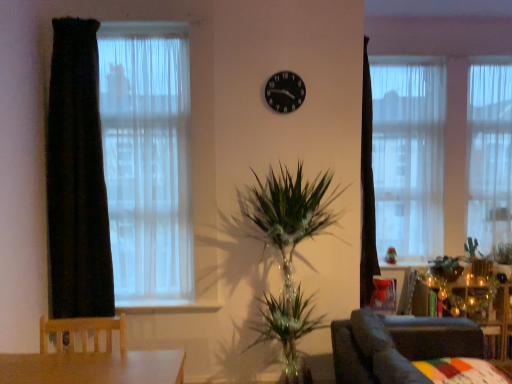
Question: Should I look upward or downward to see white sheer curtain at upper right, the second curtain in the back-to-front sequence?

Choices:
 (A) up
 (B) down

Answer: (A)

Question: From a real-world perspective, is green leafy plant at right below wooden side table at lower right?

Choices:
 (A) no
 (B) yes

Answer: (A)

Question: Is green leafy plant at right oriented away from wooden side table at lower right?

Choices:
 (A) no
 (B) yes

Answer: (A)

Question: Is green leafy plant at right touching wooden side table at lower right?

Choices:
 (A) no
 (B) yes

Answer: (A)

Question: Considering the relative sizes of green leafy plant at right and wooden side table at lower right in the image provided, is green leafy plant at right thinner than wooden side table at lower right?

Choices:
 (A) yes
 (B) no

Answer: (A)

Question: From a real-world perspective, is green leafy plant at right on wooden side table at lower right?

Choices:
 (A) yes
 (B) no

Answer: (A)

Question: Does green leafy plant at right have a smaller size compared to wooden side table at lower right?

Choices:
 (A) no
 (B) yes

Answer: (B)

Question: Does green leafy plant at right have a greater width compared to dark velvet curtain at left, which ranks as the 3th curtain in back-to-front order?

Choices:
 (A) no
 (B) yes

Answer: (A)

Question: From a real-world perspective, is green leafy plant at right on top of dark velvet curtain at left, positioned as the 1th curtain in front-to-back order?

Choices:
 (A) no
 (B) yes

Answer: (A)

Question: From the image's perspective, would you say green leafy plant at right is shown under dark velvet curtain at left, which ranks as the 3th curtain in back-to-front order?

Choices:
 (A) yes
 (B) no

Answer: (A)

Question: Is green leafy plant at right behind dark velvet curtain at left, which ranks as the 3th curtain in back-to-front order?

Choices:
 (A) yes
 (B) no

Answer: (A)

Question: Can you confirm if green leafy plant at right is taller than dark velvet curtain at left, the 3th curtain when ordered from right to left?

Choices:
 (A) yes
 (B) no

Answer: (B)

Question: From a real-world perspective, is green leafy plant at right below dark velvet curtain at left, the 3th curtain when ordered from right to left?

Choices:
 (A) no
 (B) yes

Answer: (B)

Question: Does green leafy plant at right have a larger size compared to white sheer curtain at upper right, the second curtain in the back-to-front sequence?

Choices:
 (A) yes
 (B) no

Answer: (B)